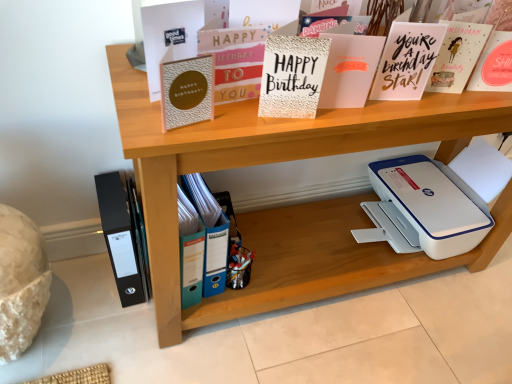
Locate an element on the screen. space that is in front of black matte folder at lower left is located at coordinates (108, 322).